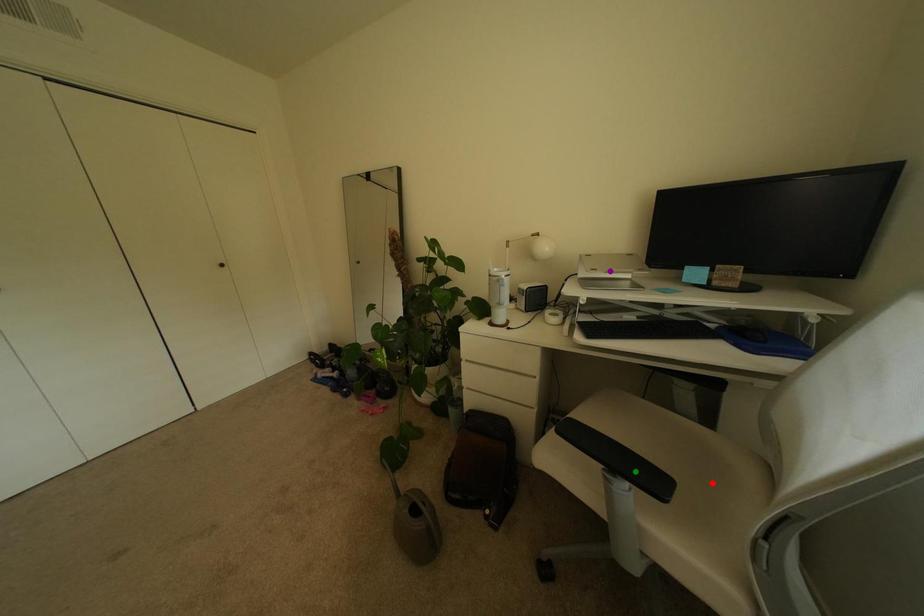
Order these from nearest to farthest:
red point | purple point | green point

red point → purple point → green point